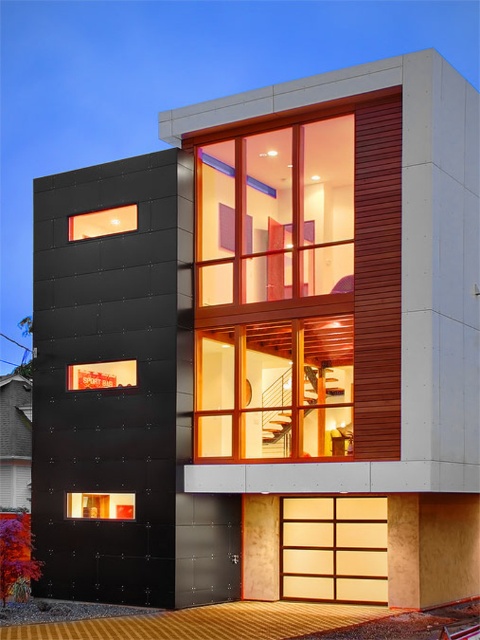
You are an architect evaluating the building facade. Which of the two windows, the matte glass window at center or the matte black window at lower left, has a larger surface area?

The matte glass window at center has a larger surface area than the matte black window at lower left.

You are standing in front of the building and want to take a photo of both the matte glass window at center and the matte black window at lower left. Which window should you focus on first to ensure both are in clear view?

You should focus on the matte glass window at center first because it is closer to the viewer, ensuring it remains in clear view while also capturing the matte black window at lower left in the background.

You are standing in front of the modern residential building and want to determine the relative positions of two points marked on its facade. The first point is at coordinates point (289, 540) and the second is at point (96, 500). Which of these points is closer to you?

Point (289, 540) is further to the viewer than point (96, 500), so the point closer to you is point (96, 500).